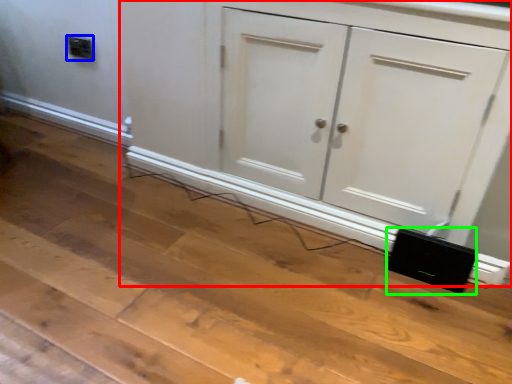
Question: Which is farther away from cupboard (highlighted by a red box)? electric outlet (highlighted by a blue box) or speaker (highlighted by a green box)?

Choices:
 (A) electric outlet
 (B) speaker

Answer: (A)